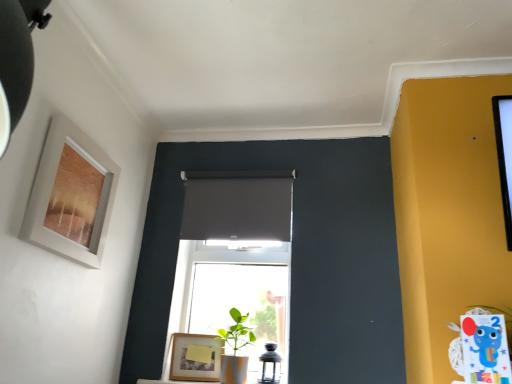
Question: From a real-world perspective, is wooden frame at lower center, which is the 2th picture frame in front-to-back order, under matte gray curtain at center?

Choices:
 (A) no
 (B) yes

Answer: (B)

Question: Is wooden frame at lower center, marked as the second picture frame in a left-to-right arrangement, touching matte gray curtain at center?

Choices:
 (A) no
 (B) yes

Answer: (A)

Question: Can you confirm if wooden frame at lower center, which appears as the first picture frame when viewed from the back, is smaller than matte gray curtain at center?

Choices:
 (A) yes
 (B) no

Answer: (A)

Question: Could you tell me if wooden frame at lower center, which appears as the first picture frame when viewed from the back, is turned towards matte gray curtain at center?

Choices:
 (A) no
 (B) yes

Answer: (A)

Question: Is wooden frame at lower center, which appears as the first picture frame when viewed from the back, not close to matte gray curtain at center?

Choices:
 (A) yes
 (B) no

Answer: (B)

Question: Is green matte plant at center taller or shorter than transparent glass lantern at center?

Choices:
 (A) tall
 (B) short

Answer: (B)

Question: Is green matte plant at center bigger or smaller than transparent glass lantern at center?

Choices:
 (A) big
 (B) small

Answer: (B)

Question: Visually, is green matte plant at center positioned to the left or to the right of transparent glass lantern at center?

Choices:
 (A) left
 (B) right

Answer: (B)

Question: Is green matte plant at center wider or thinner than transparent glass lantern at center?

Choices:
 (A) thin
 (B) wide

Answer: (B)

Question: In terms of width, does transparent glass lantern at center look wider or thinner when compared to wooden frame at lower center, marked as the second picture frame in a left-to-right arrangement?

Choices:
 (A) wide
 (B) thin

Answer: (A)

Question: From a real-world perspective, is transparent glass lantern at center above or below wooden frame at lower center, marked as the 1th picture frame in a bottom-to-top arrangement?

Choices:
 (A) below
 (B) above

Answer: (A)

Question: Relative to wooden frame at lower center, marked as the 1th picture frame in a bottom-to-top arrangement, is transparent glass lantern at center in front or behind?

Choices:
 (A) front
 (B) behind

Answer: (A)

Question: From the image's perspective, is transparent glass lantern at center above or below wooden frame at lower center, which appears as the 2th picture frame when viewed from the top?

Choices:
 (A) below
 (B) above

Answer: (B)

Question: In terms of height, does transparent glass lantern at center look taller or shorter compared to green matte plant at center?

Choices:
 (A) short
 (B) tall

Answer: (B)

Question: Is transparent glass lantern at center spatially inside green matte plant at center, or outside of it?

Choices:
 (A) outside
 (B) inside

Answer: (A)